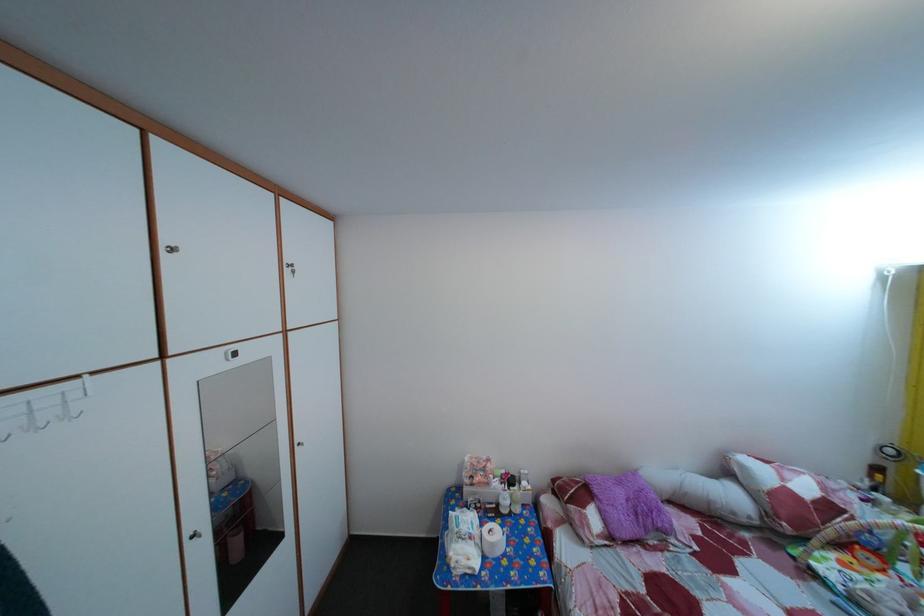
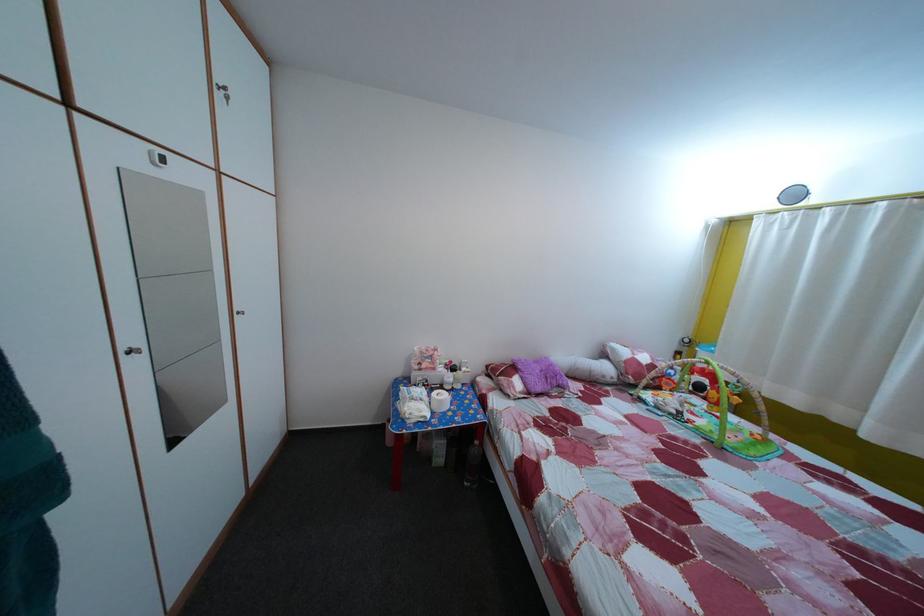
In a continuous first-person perspective shot, in which direction is the camera moving?

The cameraman walked toward left, backward.